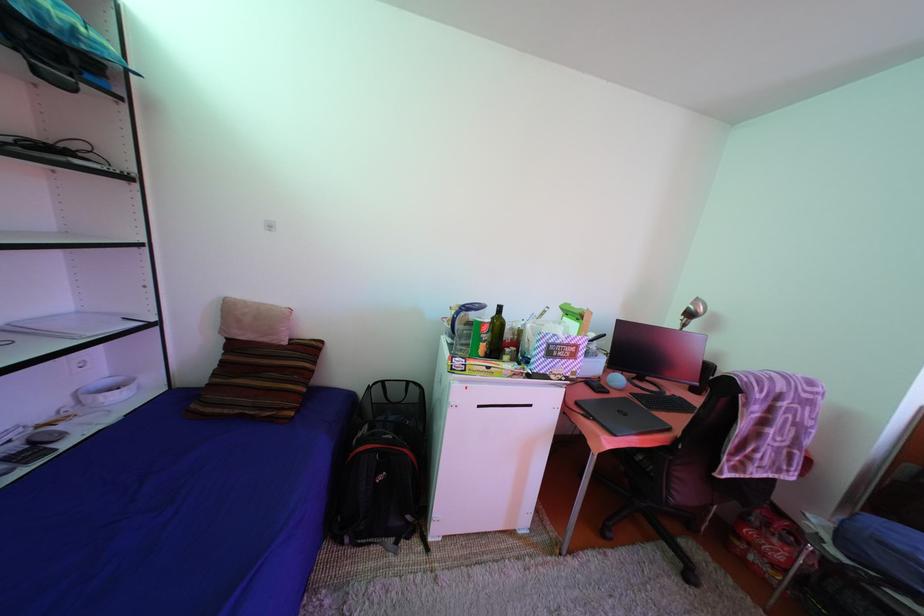
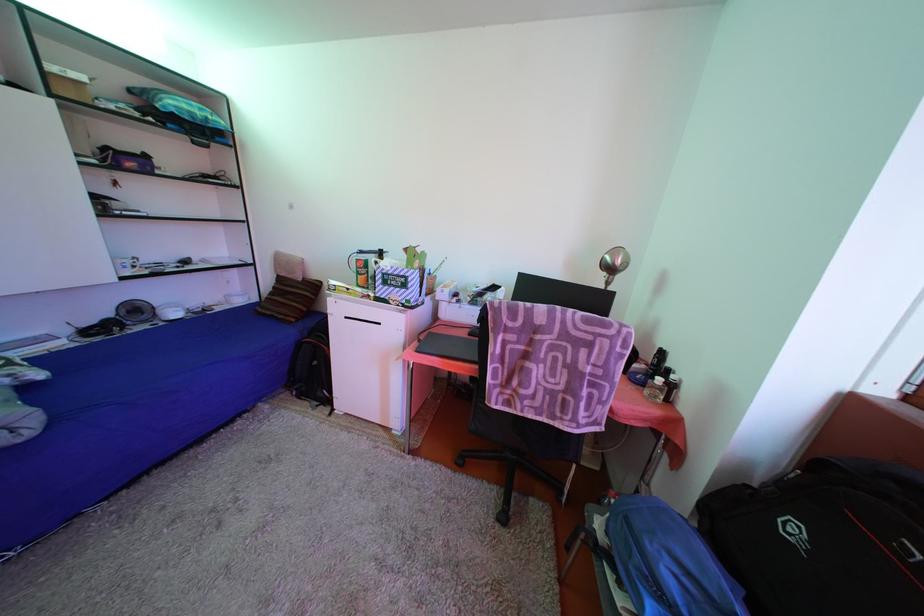
Question: In a continuous first-person perspective shot, in which direction is the camera moving?

Choices:
 (A) Left
 (B) Right
 (C) Forward
 (D) Backward

Answer: (B)